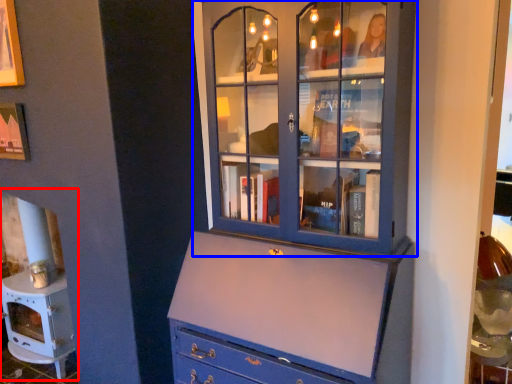
Question: Among these objects, which one is farthest to the camera, fireplace (highlighted by a red box) or cupboard (highlighted by a blue box)?

Choices:
 (A) fireplace
 (B) cupboard

Answer: (A)